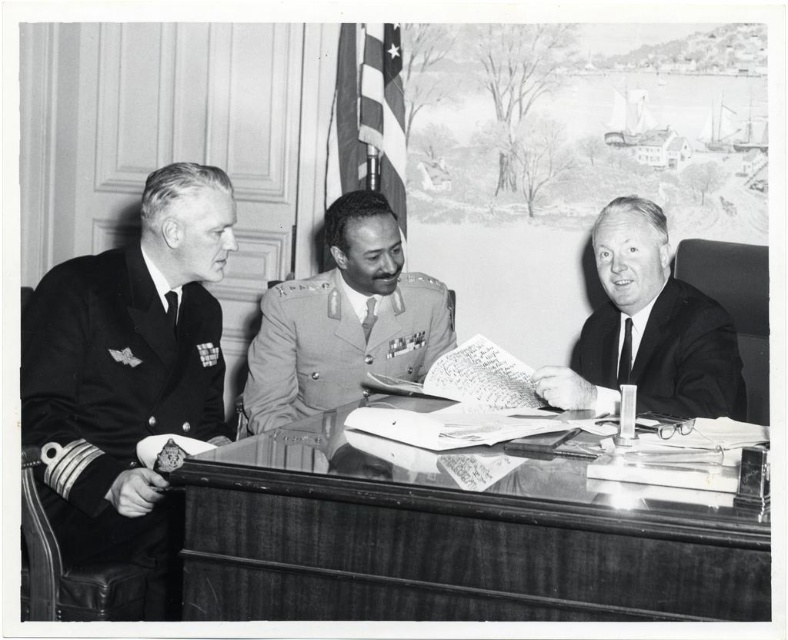
Based on the scene description, which object label corresponds to the coordinates point at [129,376]?

The point at [129,376] corresponds to the uniformed officer at left.

You are a photographer who needs to capture a closeup of the uniformed officer at left and the smooth black suit at center. Since you can only focus on one subject at a time, which one should you choose to ensure the other is still in the frame?

You should focus on the uniformed officer at left because they are positioned on the left side of the smooth black suit at center, so focusing on the left subject will keep the right subject in the frame.